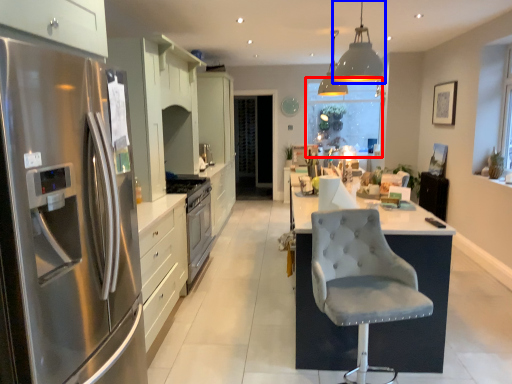
Question: Which object appears closest to the camera in this image, window screen (highlighted by a red box) or light fixture (highlighted by a blue box)?

Choices:
 (A) window screen
 (B) light fixture

Answer: (B)